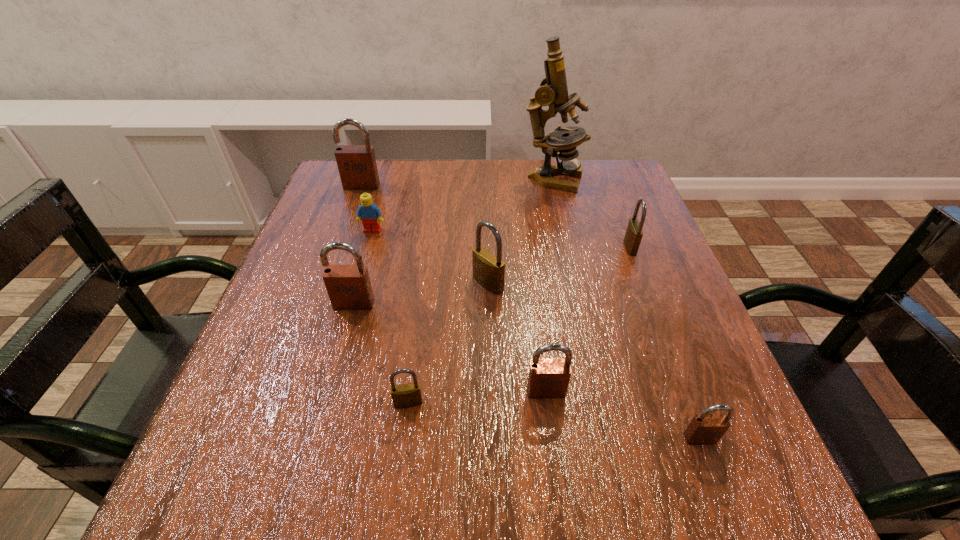
The width and height of the screenshot is (960, 540). Find the location of `vacant space located 0.220m on the front-facing side of the fourth nearest padlock`. vacant space located 0.220m on the front-facing side of the fourth nearest padlock is located at coordinates (322, 418).

I want to click on free location located on the front of the second biggest brass padlock, so click(x=701, y=435).

At what (x,y) coordinates should I click in order to perform the action: click on free space located 0.140m on the front-facing side of the fifth padlock from left to right. Please return your answer as a coordinate pair (x, y). Looking at the image, I should click on (559, 491).

You are a GUI agent. You are given a task and a screenshot of the screen. Output one action in this format:
    pyautogui.click(x=<x>, y=<y>)
    Task: Click on the vacant space located on the face of the blue Lego
    The width and height of the screenshot is (960, 540).
    Given the screenshot: What is the action you would take?
    pyautogui.click(x=356, y=289)

This screenshot has height=540, width=960. I want to click on blank space located on the right of the leftmost brass padlock, so click(557, 403).

At what (x,y) coordinates should I click in order to perform the action: click on microscope at the far edge. Please return your answer as a coordinate pair (x, y). Looking at the image, I should click on (553, 92).

The height and width of the screenshot is (540, 960). What are the coordinates of `padlock situated at the far edge` in the screenshot? It's located at (357, 167).

This screenshot has width=960, height=540. Identify the location of Lego at the left edge. (368, 212).

Where is `microscope that is positioned at the right edge`? Image resolution: width=960 pixels, height=540 pixels. microscope that is positioned at the right edge is located at coordinates (553, 92).

The width and height of the screenshot is (960, 540). Identify the location of object at the far left corner. (357, 167).